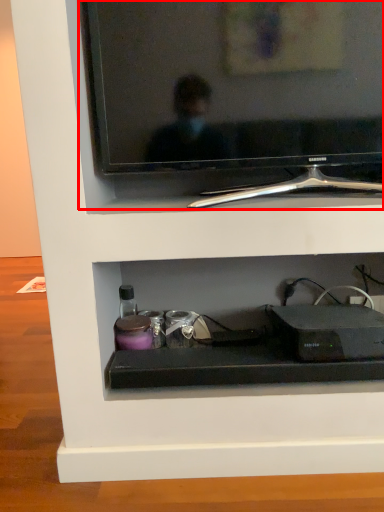
Question: From the image's perspective, what is the correct spatial positioning of television (annotated by the red box) in reference to gadget?

Choices:
 (A) below
 (B) above

Answer: (B)